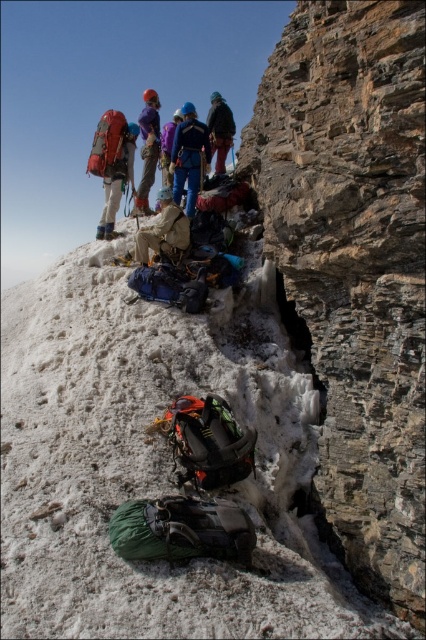
Describe the element at coordinates (219, 129) in the screenshot. This screenshot has height=640, width=426. I see `camouflage fabric jacket at center` at that location.

Is the position of camouflage fabric jacket at center more distant than that of purple fleece jacket at upper center?

Yes, camouflage fabric jacket at center is behind purple fleece jacket at upper center.

At what (x,y) coordinates should I click in order to perform the action: click on camouflage fabric jacket at center. Please return your answer as a coordinate pair (x, y). Image resolution: width=426 pixels, height=640 pixels. Looking at the image, I should click on [x=219, y=129].

I want to click on camouflage fabric jacket at center, so click(x=219, y=129).

Is beige fabric jacket at center below camouflage fabric jacket at center?

Correct, beige fabric jacket at center is located below camouflage fabric jacket at center.

Is point (143, 252) positioned behind point (215, 113)?

No, it is not.

At what (x,y) coordinates should I click in order to perform the action: click on beige fabric jacket at center. Please return your answer as a coordinate pair (x, y). The image size is (426, 640). Looking at the image, I should click on (161, 232).

Is beige fabric jacket at center taller than purple fabric helmet at upper center?

Incorrect, beige fabric jacket at center's height is not larger of purple fabric helmet at upper center's.

Can you confirm if beige fabric jacket at center is positioned to the right of purple fabric helmet at upper center?

Correct, you'll find beige fabric jacket at center to the right of purple fabric helmet at upper center.

Does point (166, 189) lie behind point (150, 93)?

No, it is not.

Identify the location of beige fabric jacket at center. The height and width of the screenshot is (640, 426). (161, 232).